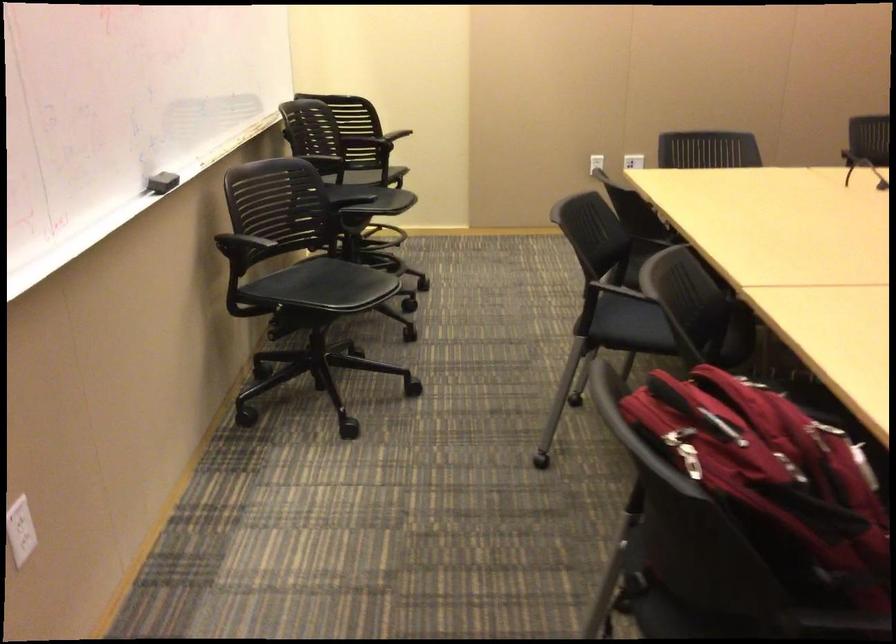
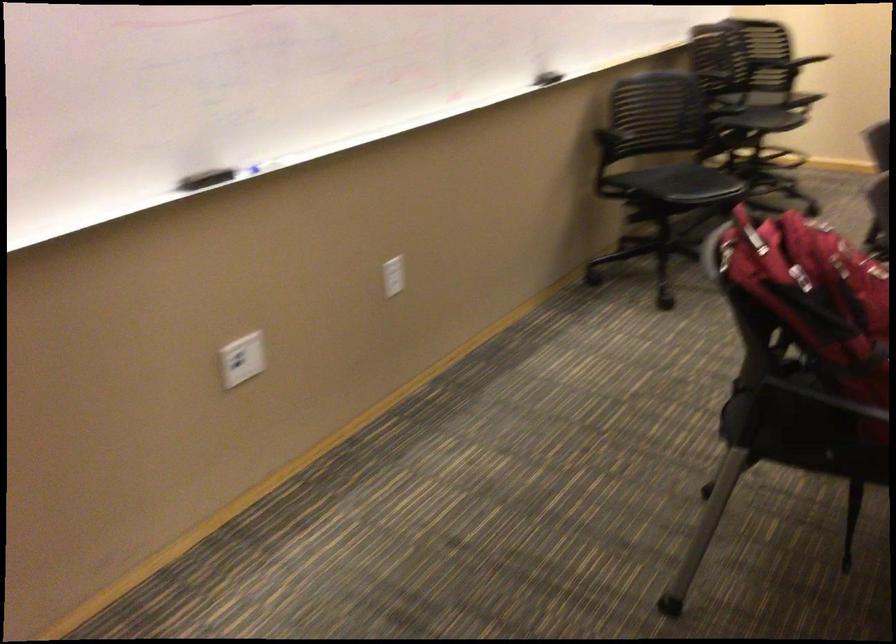
Where in the second image is the point corresponding to pixel 790 491 from the first image?

(815, 295)